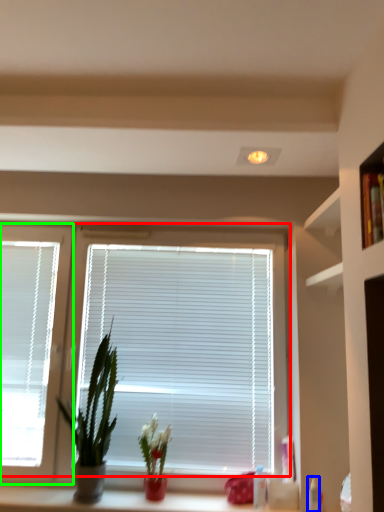
Question: Which object is the closest to the window blind (highlighted by a red box)? Choose among these: toiletry (highlighted by a blue box) or window (highlighted by a green box).

Choices:
 (A) toiletry
 (B) window

Answer: (B)